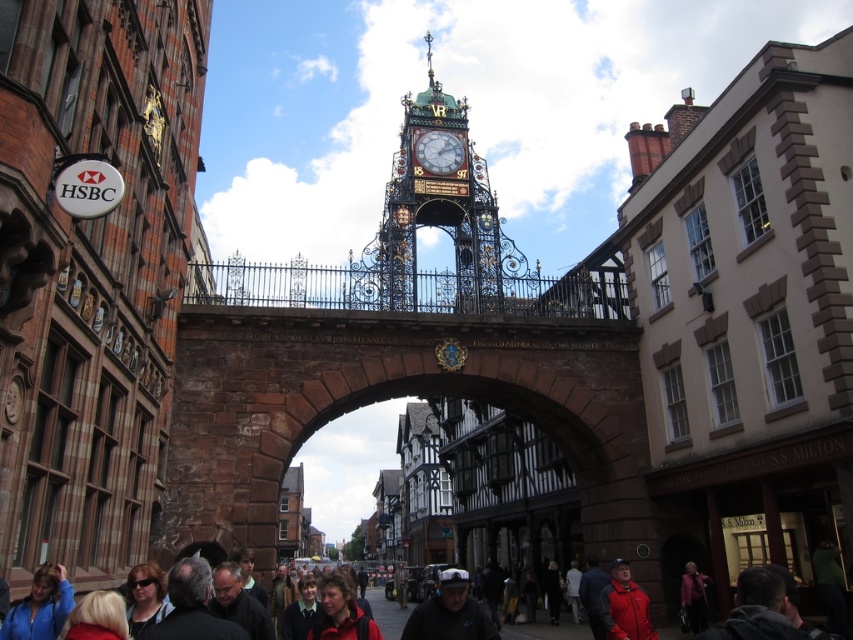
You are standing on the street and see two points marked in the image. The first point is at coordinate point (138,611) and the second is at point (701,593). Which point is closer to you?

Point (138,611) is closer to the viewer than point (701,593).

You are a tailor who needs to determine which garment takes up more space in your store. You see a dark gray suit at lower left and a dark gray jacket at lower right. Which one requires more storage space?

The dark gray jacket at lower right requires more storage space because it occupies more space than the dark gray suit at lower left.